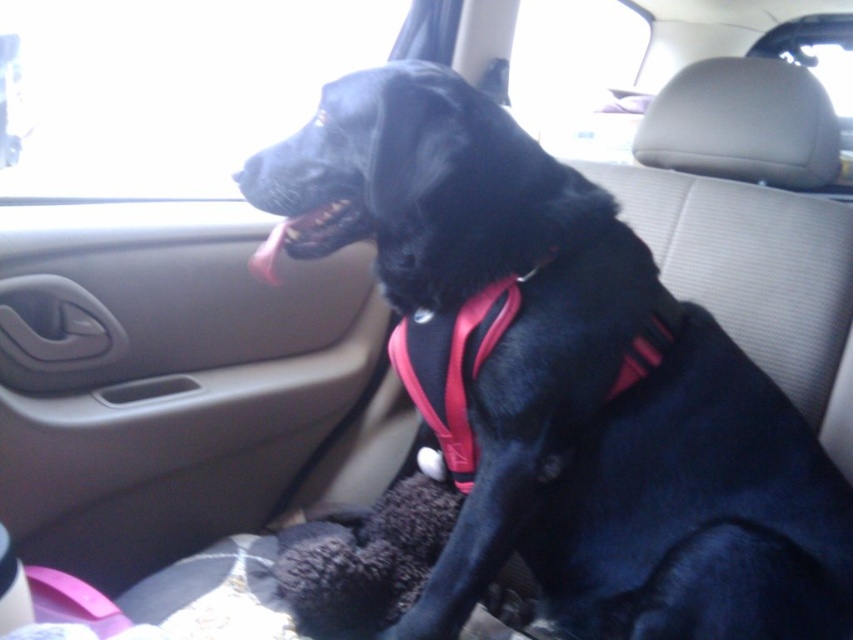
You are a veterinarian assessing the dog in the car. You need to check the dog for any signs of distress. The dog is sitting at the center of the back seat. How far apart are the black matte dog at center and the black matte teeth at center?

The black matte dog at center is 35.42 centimeters from the black matte teeth at center, so the distance between them is 35.42 centimeters.

You are a passenger in the car and want to point out both the black matte dog at center and the black matte teeth at center to a friend. Which one is located to the right of the other?

The black matte dog at center is located to the right of the black matte teeth at center.